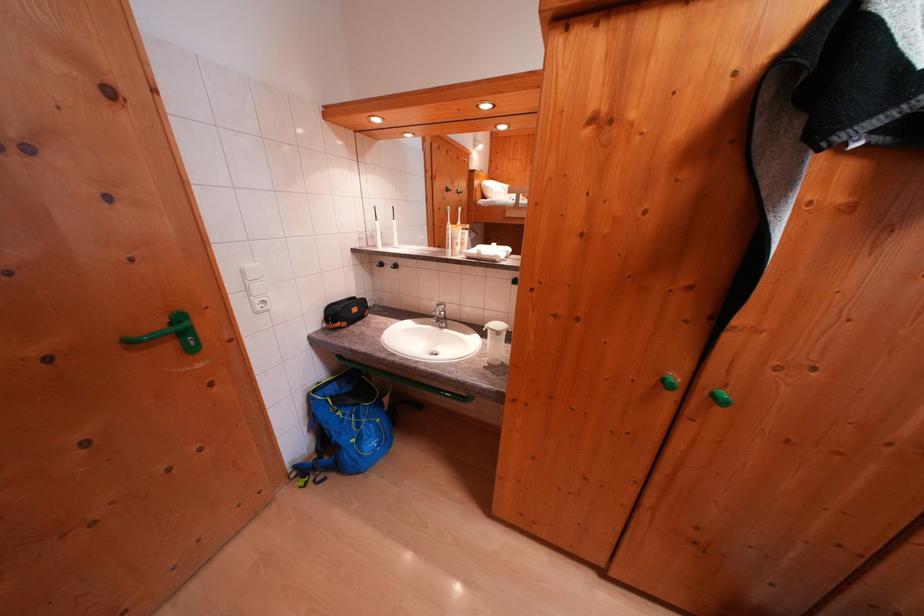
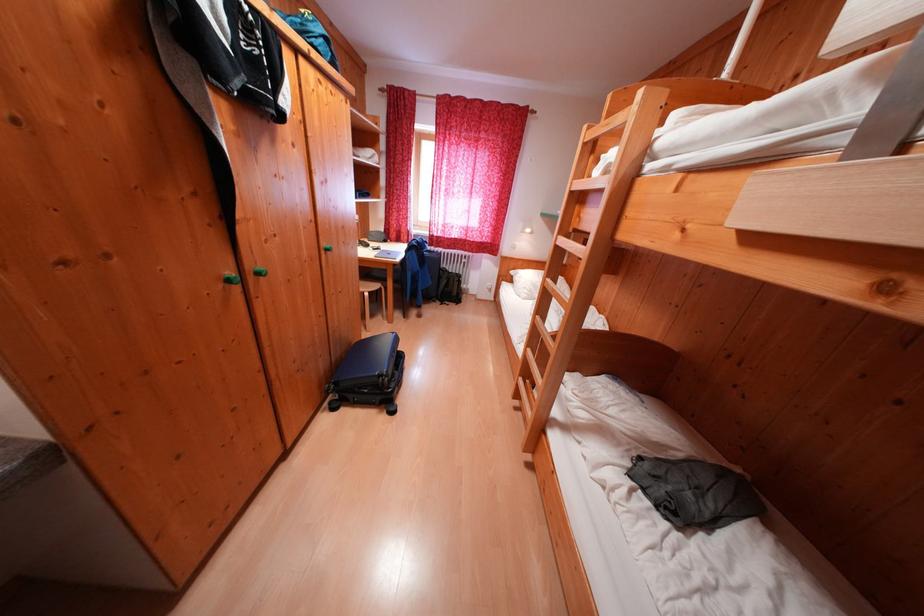
The point at (684, 382) is marked in the first image. Where is the corresponding point in the second image?

(238, 278)